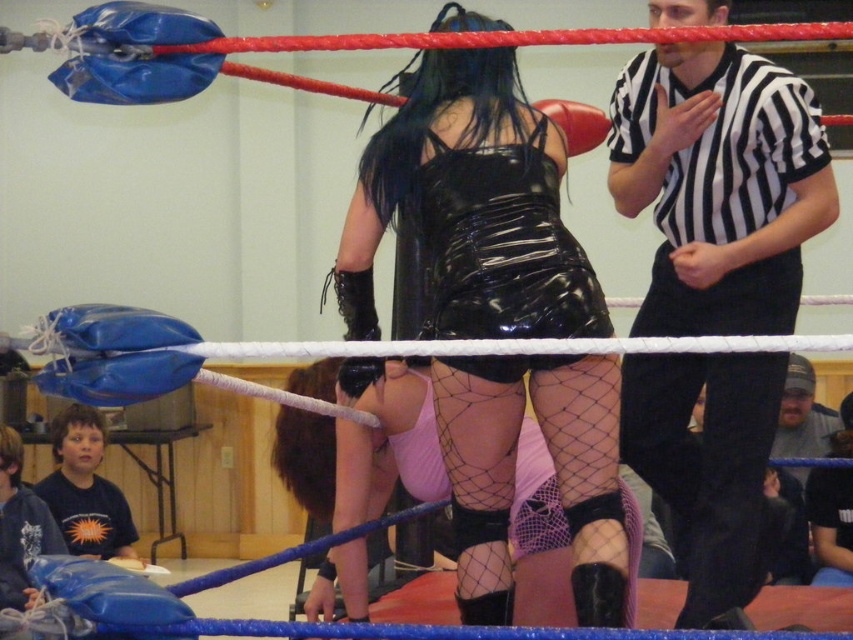
Question: Does black mesh tights at center have a smaller size compared to black glossy dress at center?

Choices:
 (A) yes
 (B) no

Answer: (B)

Question: Is black shiny dress at center positioned at the back of black leather boxing glove at center?

Choices:
 (A) yes
 (B) no

Answer: (B)

Question: From the image, what is the correct spatial relationship of black shiny dress at center in relation to black leather boxing glove at center?

Choices:
 (A) above
 (B) below

Answer: (B)

Question: Which object is closer to the camera taking this photo?

Choices:
 (A) black striped shirt at upper right
 (B) fishnet stockings at center

Answer: (B)

Question: Which is farther from the black leather boxing glove at center?

Choices:
 (A) black mesh tights at center
 (B) fishnet stockings at center

Answer: (A)

Question: Among these objects, which one is nearest to the camera?

Choices:
 (A) fishnet stockings at center
 (B) black shiny dress at center

Answer: (B)